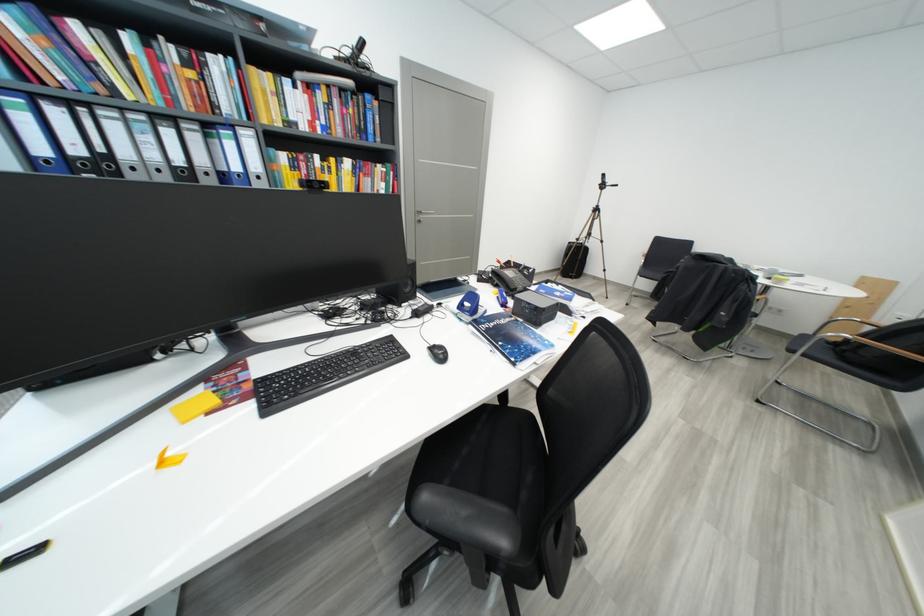
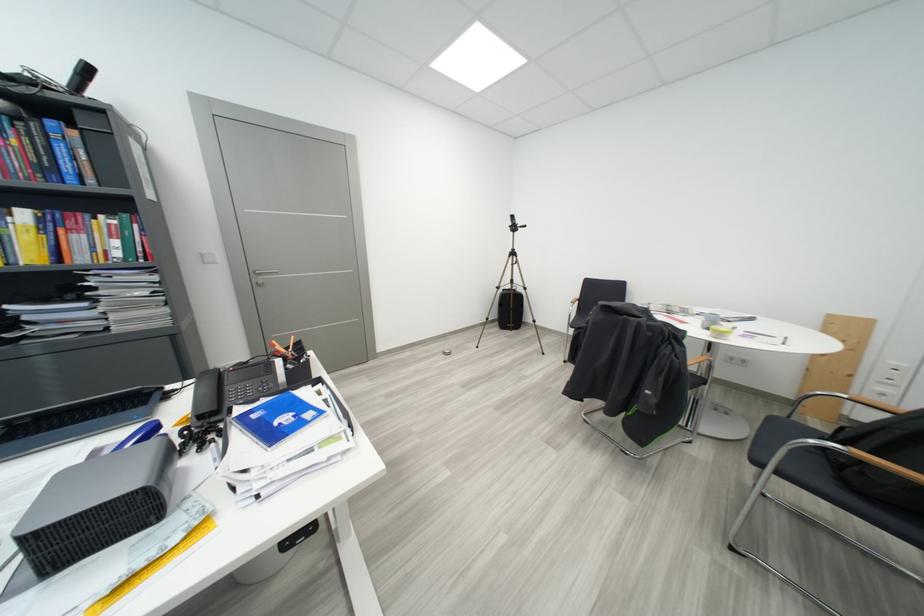
In a continuous first-person perspective shot, in which direction is the camera moving?

The cameraman moved toward right, forward.